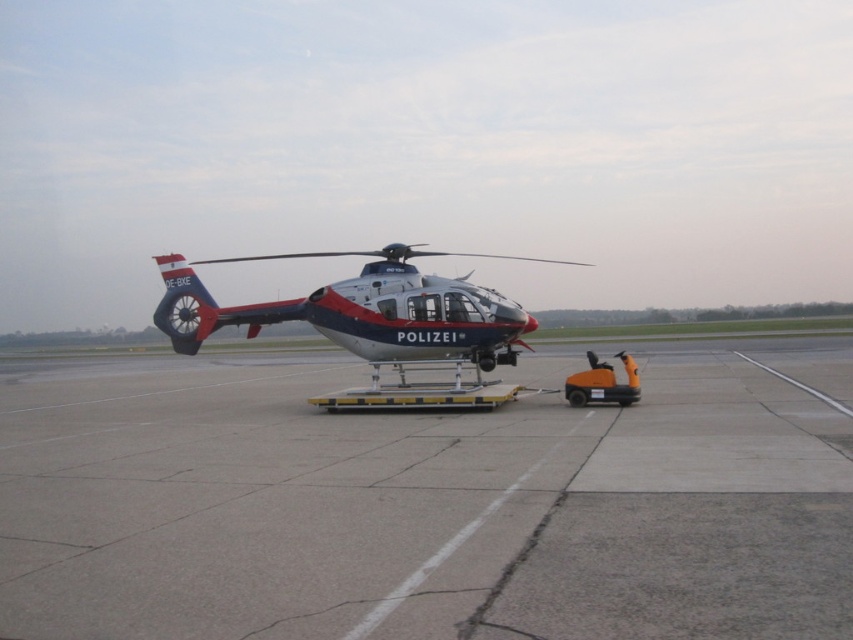
Question: Which of the following is the closest to the observer?

Choices:
 (A) metallic silver helicopter at center
 (B) gray concrete tarmac at center

Answer: (B)

Question: Can you confirm if gray concrete tarmac at center is thinner than metallic silver helicopter at center?

Choices:
 (A) no
 (B) yes

Answer: (B)

Question: Which object appears closest to the camera in this image?

Choices:
 (A) gray concrete tarmac at center
 (B) metallic silver helicopter at center

Answer: (A)

Question: Is gray concrete tarmac at center smaller than metallic silver helicopter at center?

Choices:
 (A) no
 (B) yes

Answer: (B)

Question: Does gray concrete tarmac at center appear on the right side of metallic silver helicopter at center?

Choices:
 (A) yes
 (B) no

Answer: (A)